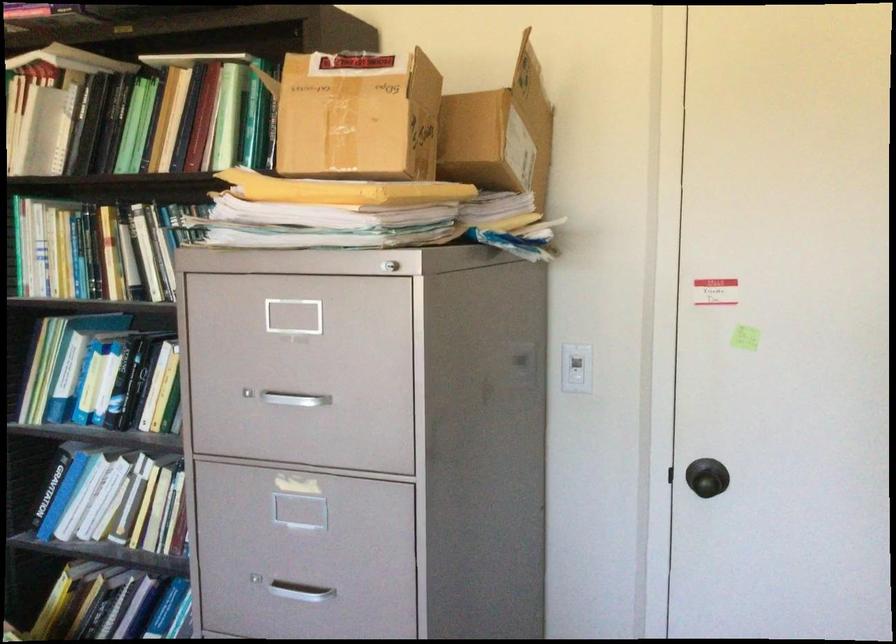
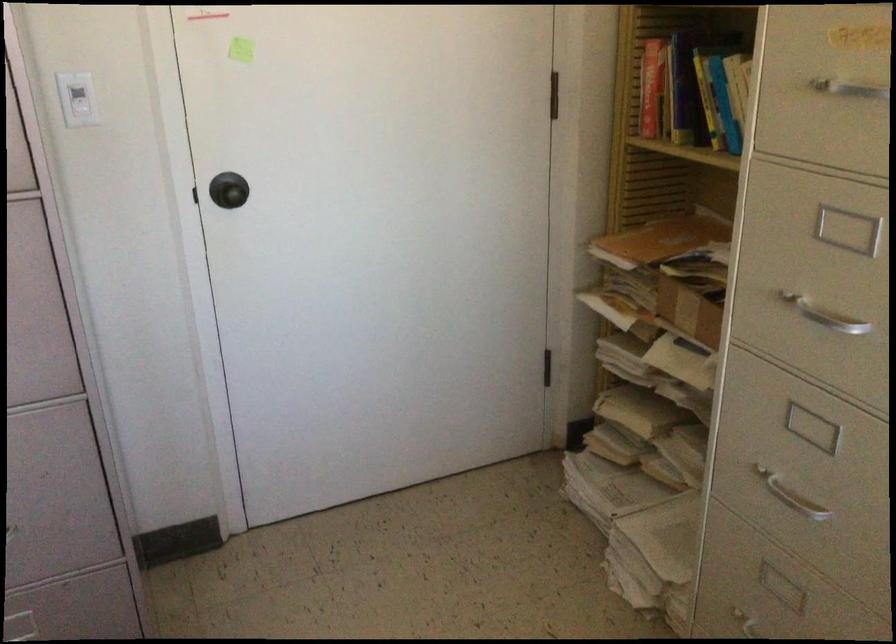
Where in the second image is the point corresponding to the point at 586,368 from the first image?

(76, 99)